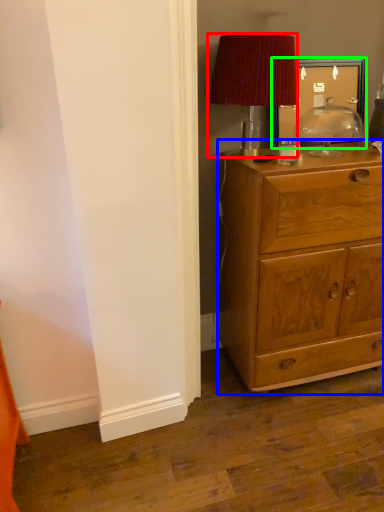
Question: Which object is positioned farthest from lamp (highlighted by a red box)? Select from chest of drawers (highlighted by a blue box) and picture frame (highlighted by a green box).

Choices:
 (A) chest of drawers
 (B) picture frame

Answer: (A)